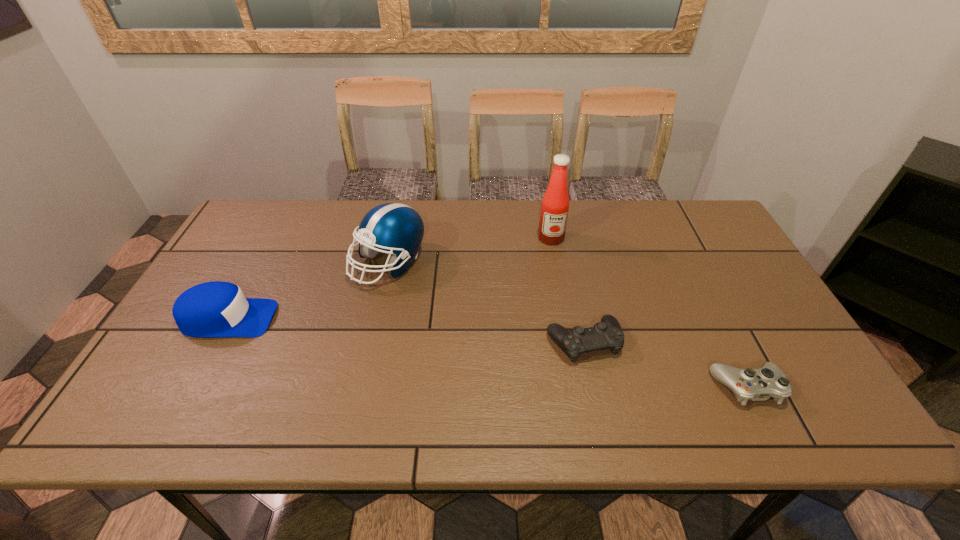
Where is `condiment`? The image size is (960, 540). condiment is located at coordinates (555, 204).

The height and width of the screenshot is (540, 960). What are the coordinates of `the fourth object from right to left` in the screenshot? It's located at (394, 227).

Locate an element on the screen. the fourth shortest object is located at coordinates (394, 227).

What are the coordinates of `the leftmost object` in the screenshot? It's located at (212, 309).

Identify the location of baseball cap. The height and width of the screenshot is (540, 960). (212, 309).

At what (x,y) coordinates should I click in order to perform the action: click on the left control. Please return your answer as a coordinate pair (x, y). Looking at the image, I should click on (607, 334).

At what (x,y) coordinates should I click in order to perform the action: click on the nearest object. Please return your answer as a coordinate pair (x, y). Looking at the image, I should click on (760, 384).

The width and height of the screenshot is (960, 540). Find the location of `the rightmost object`. the rightmost object is located at coordinates (760, 384).

Identify the location of blank area located on the front-facing side of the tallest object. (556, 264).

Locate an element on the screen. The height and width of the screenshot is (540, 960). vacant area situated at the front of the fourth object from right to left with the faceguard is located at coordinates (366, 367).